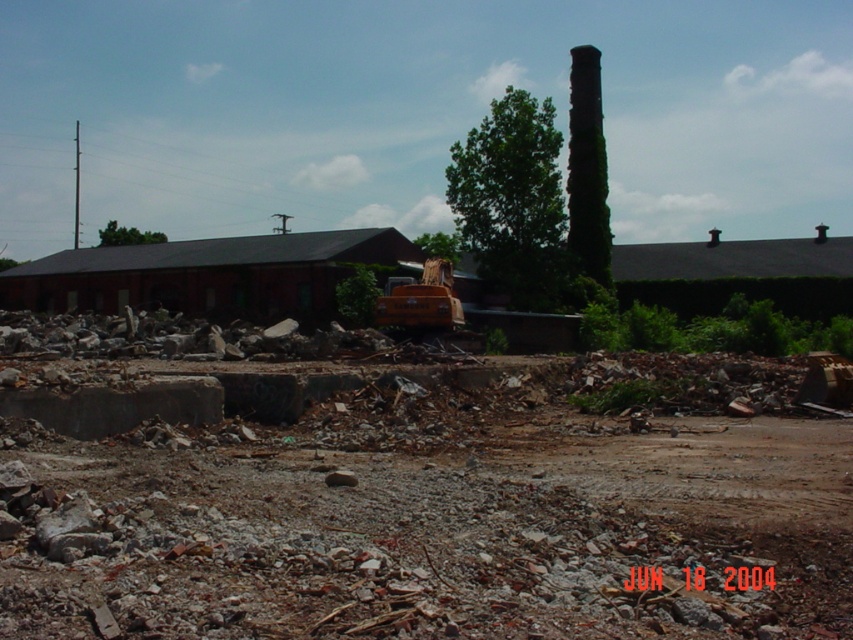
You are a delivery driver who needs to transport a large crate that requires a path wider than the orange rubber excavator at center. Is the brown dirt track at center wide enough for the crate?

The brown dirt track at center is bigger than the orange rubber excavator at center, so the track is wide enough to accommodate the large crate as it is larger than the excavator.

You are a delivery truck driver who needs to navigate through the brown dirt track at center and the orange rubber excavator at center. Which path should you take to avoid the excavator?

The brown dirt track at center is to the right of the orange rubber excavator at center, so you should take the path to the right of the orange rubber excavator at center to avoid it.